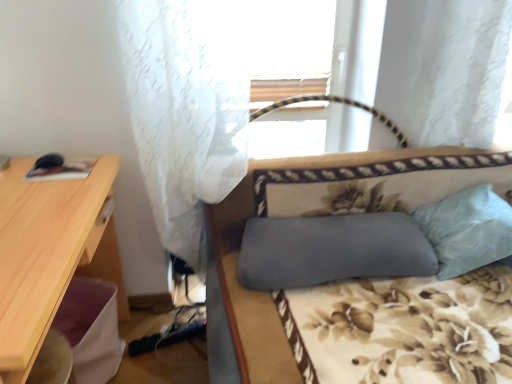
Question: Should I look upward or downward to see light blue fabric pillow at right, which appears as the first pillow when viewed from the right?

Choices:
 (A) up
 (B) down

Answer: (B)

Question: Can you confirm if gray fabric studio couch at center is shorter than light wood desk at left?

Choices:
 (A) yes
 (B) no

Answer: (A)

Question: Is gray fabric studio couch at center positioned before light wood desk at left?

Choices:
 (A) yes
 (B) no

Answer: (B)

Question: Is gray fabric studio couch at center bigger than light wood desk at left?

Choices:
 (A) no
 (B) yes

Answer: (B)

Question: Is gray fabric studio couch at center to the left of light wood desk at left from the viewer's perspective?

Choices:
 (A) yes
 (B) no

Answer: (B)

Question: Could light wood desk at left be considered to be inside gray fabric studio couch at center?

Choices:
 (A) no
 (B) yes

Answer: (A)

Question: Is gray fabric studio couch at center facing towards light wood desk at left?

Choices:
 (A) no
 (B) yes

Answer: (A)

Question: Is gray fabric pillow at center, which is the 1th pillow from left to right, not near gray fabric studio couch at center?

Choices:
 (A) yes
 (B) no

Answer: (B)

Question: From a real-world perspective, is gray fabric pillow at center, which is the 1th pillow from left to right, on top of gray fabric studio couch at center?

Choices:
 (A) yes
 (B) no

Answer: (A)

Question: From a real-world perspective, is gray fabric pillow at center, which is the 1th pillow from left to right, below gray fabric studio couch at center?

Choices:
 (A) no
 (B) yes

Answer: (A)

Question: From the image's perspective, is gray fabric pillow at center, which appears as the second pillow when viewed from the right, on top of gray fabric studio couch at center?

Choices:
 (A) no
 (B) yes

Answer: (B)

Question: Can you confirm if gray fabric pillow at center, which appears as the second pillow when viewed from the right, is bigger than gray fabric studio couch at center?

Choices:
 (A) yes
 (B) no

Answer: (B)

Question: Is gray fabric pillow at center, which is the 1th pillow from left to right, touching gray fabric studio couch at center?

Choices:
 (A) yes
 (B) no

Answer: (B)

Question: Can you confirm if light blue fabric pillow at right, the second pillow positioned from the left, is thinner than gray fabric studio couch at center?

Choices:
 (A) yes
 (B) no

Answer: (A)